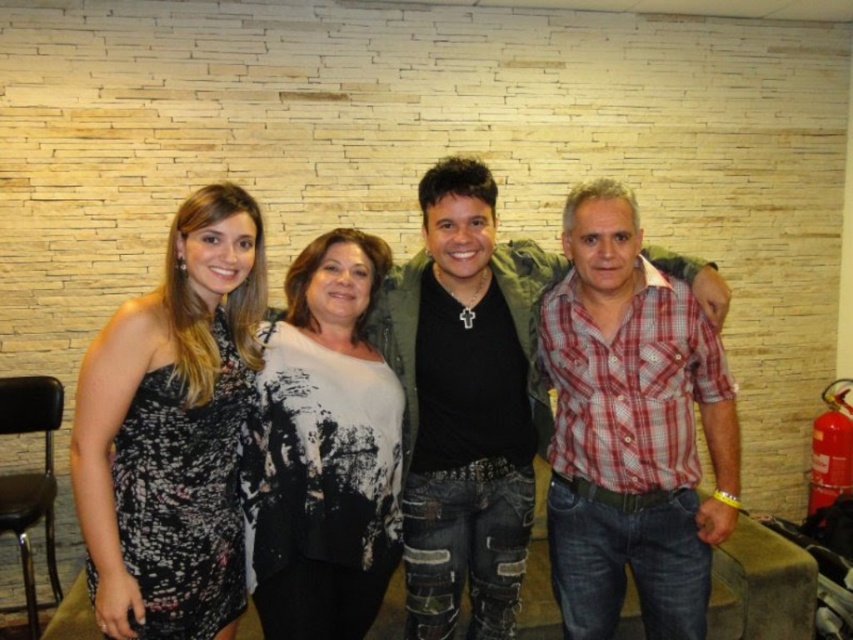
Question: Which point is closer to the camera taking this photo?

Choices:
 (A) (180, 257)
 (B) (289, 614)

Answer: (A)

Question: From the image, what is the correct spatial relationship of black satin dress at left in relation to white textured sweater at center?

Choices:
 (A) left
 (B) right

Answer: (A)

Question: Which point is closer to the camera?

Choices:
 (A) (276, 428)
 (B) (471, 196)

Answer: (A)

Question: Can you confirm if black satin dress at left is thinner than red plaid shirt at center?

Choices:
 (A) yes
 (B) no

Answer: (A)

Question: Which object appears farthest from the camera in this image?

Choices:
 (A) white textured sweater at center
 (B) red plaid shirt at center

Answer: (B)

Question: Does black satin dress at left have a smaller size compared to white textured sweater at center?

Choices:
 (A) yes
 (B) no

Answer: (B)